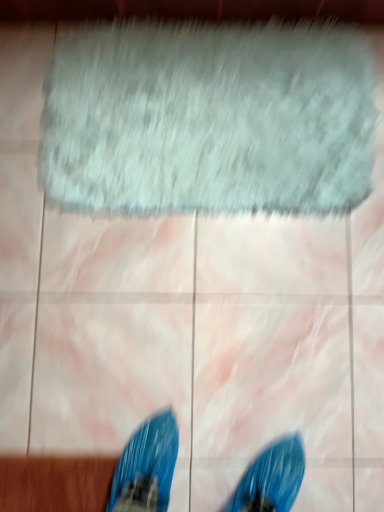
This screenshot has height=512, width=384. In order to click on vacant space underneath gray fuzzy bath mat at upper center (from a real-world perspective) in this screenshot , I will do `click(209, 123)`.